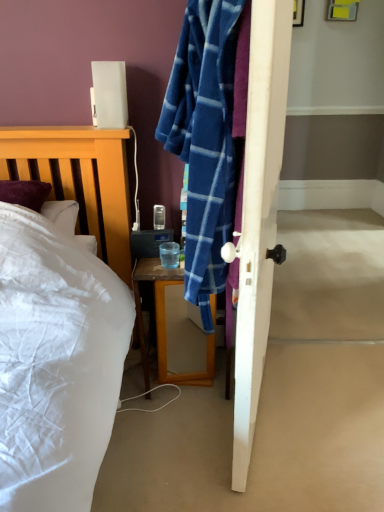
Question: From a real-world perspective, is transparent glass at bedside physically located above or below yellow plastic picture frame at upper right?

Choices:
 (A) above
 (B) below

Answer: (B)

Question: Considering the positions of transparent glass at bedside and yellow plastic picture frame at upper right in the image, is transparent glass at bedside bigger or smaller than yellow plastic picture frame at upper right?

Choices:
 (A) small
 (B) big

Answer: (A)

Question: Based on their relative distances, which object is farther from the wooden desk at center?

Choices:
 (A) satin white lamp at upper left
 (B) yellow plastic picture frame at upper right
 (C) transparent glass at bedside

Answer: (B)

Question: Estimate the real-world distances between objects in this image. Which object is closer to the satin white lamp at upper left?

Choices:
 (A) wooden desk at center
 (B) yellow plastic picture frame at upper right
 (C) transparent glass at bedside

Answer: (C)